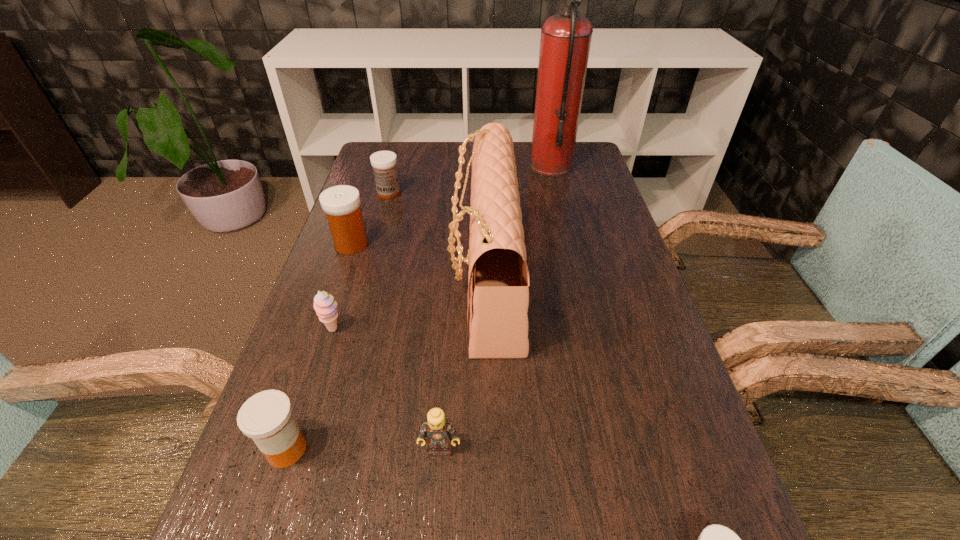
Find the location of a particular element. The width and height of the screenshot is (960, 540). free space between the third farthest medicine and the sherbert is located at coordinates (310, 389).

Where is `free point between the sherbert and the farthest white medicine`? Image resolution: width=960 pixels, height=540 pixels. free point between the sherbert and the farthest white medicine is located at coordinates (361, 261).

Locate an element on the screen. Image resolution: width=960 pixels, height=540 pixels. object that is the third closest to the red fire extinguisher is located at coordinates (341, 204).

Identify the location of object that is the seventh closest to the fire extinguisher. (715, 539).

Find the location of a particular element. medicine that stands as the second closest to the orange medicine is located at coordinates (715, 539).

Choose which medicine is the second nearest neighbor to the second nearest medicine. Please provide its 2D coordinates. Your answer should be formatted as a tuple, i.e. [(x, y)], where the tuple contains the x and y coordinates of a point satisfying the conditions above.

[(715, 539)]

Locate an element on the screen. The image size is (960, 540). white medicine that is the third closest to the sherbert is located at coordinates (715, 539).

Locate an element on the screen. The height and width of the screenshot is (540, 960). the closest white medicine relative to the nearest white medicine is located at coordinates (341, 204).

What are the coordinates of `vacant space that satisfies the following two spatial constraints: 1. on the front-facing side of the handbag; 2. in front of the tan Lego` in the screenshot? It's located at (489, 449).

Locate an element on the screen. vacant space that satisfies the following two spatial constraints: 1. in front of the tan Lego; 2. on the label of the orange medicine is located at coordinates (440, 449).